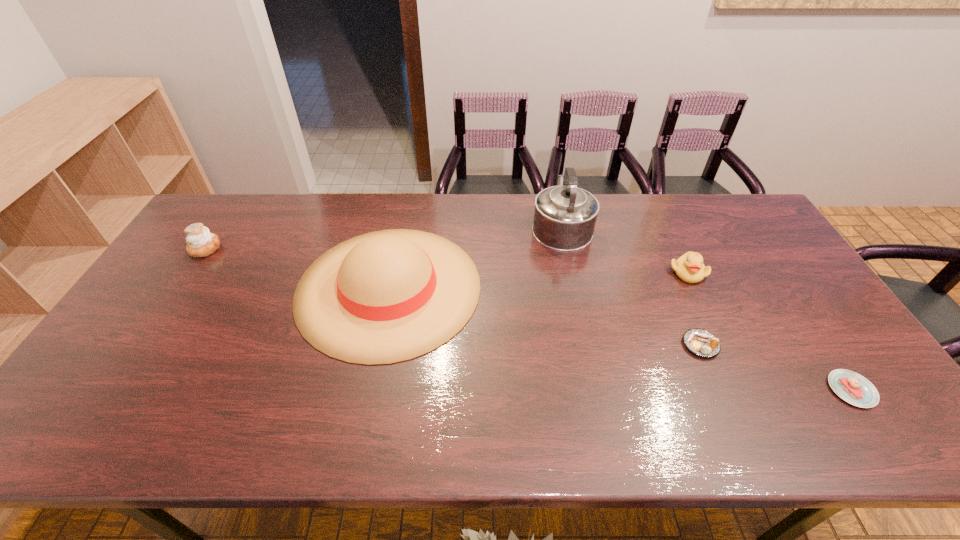
I want to click on vacant point located on the left of the fifth shortest object, so click(279, 288).

Identify the location of vacant space situated 0.180m on the right of the leftmost pastry. This screenshot has height=540, width=960. (276, 248).

This screenshot has height=540, width=960. I want to click on free space located at the face of the duckling, so click(x=718, y=336).

Locate an element on the screen. The width and height of the screenshot is (960, 540). vacant region located on the left of the second pastry from left to right is located at coordinates (656, 345).

At what (x,y) coordinates should I click in order to perform the action: click on free point located on the back of the nearest pastry. Please return your answer as a coordinate pair (x, y). Image resolution: width=960 pixels, height=540 pixels. Looking at the image, I should click on (776, 277).

Image resolution: width=960 pixels, height=540 pixels. In order to click on kettle at the far edge in this screenshot , I will do `click(565, 216)`.

Locate an element on the screen. The width and height of the screenshot is (960, 540). sombrero that is at the far edge is located at coordinates (386, 296).

At what (x,y) coordinates should I click in order to perform the action: click on object that is at the near edge. Please return your answer as a coordinate pair (x, y). Looking at the image, I should click on (852, 387).

Locate an element on the screen. This screenshot has height=540, width=960. object present at the left edge is located at coordinates (200, 242).

At what (x,y) coordinates should I click in order to perform the action: click on object positioned at the right edge. Please return your answer as a coordinate pair (x, y). The width and height of the screenshot is (960, 540). Looking at the image, I should click on (852, 387).